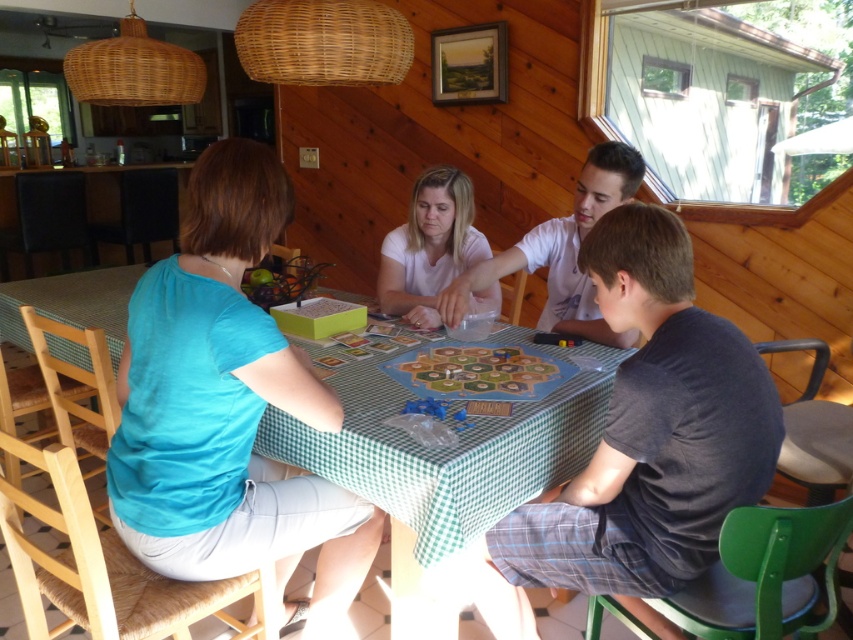
Based on the photo, you are standing at the edge of the dining table in the cabin. You see two points marked on the table surface, one at coordinates point [227,266] and another at point [622,180]. If you want to reach the point that is closer to you first, which coordinate should you move towards?

You should move towards point [227,266] because it is closer to you than point [622,180].

You are a guest at the cabin and want to place a small snack on the green checkered table at center without blocking the teal fabric shirt at left. Is this possible?

The teal fabric shirt at left is in front of the green checkered table at center, so placing the snack on the table would not block the shirt since it is behind the shirt from your perspective.

You are standing in front of the dining table and want to reach a point located at coordinates point (x=473, y=269). If your height is 5.9 feet, will you be able to see the point without bending down?

The distance of point (x=473, y=269) from viewer is 6.90 feet. Since your height is 5.9 feet, the point is 1.0 feet higher than your eye level, so you would need to tilt your head slightly upwards to see it, but you won